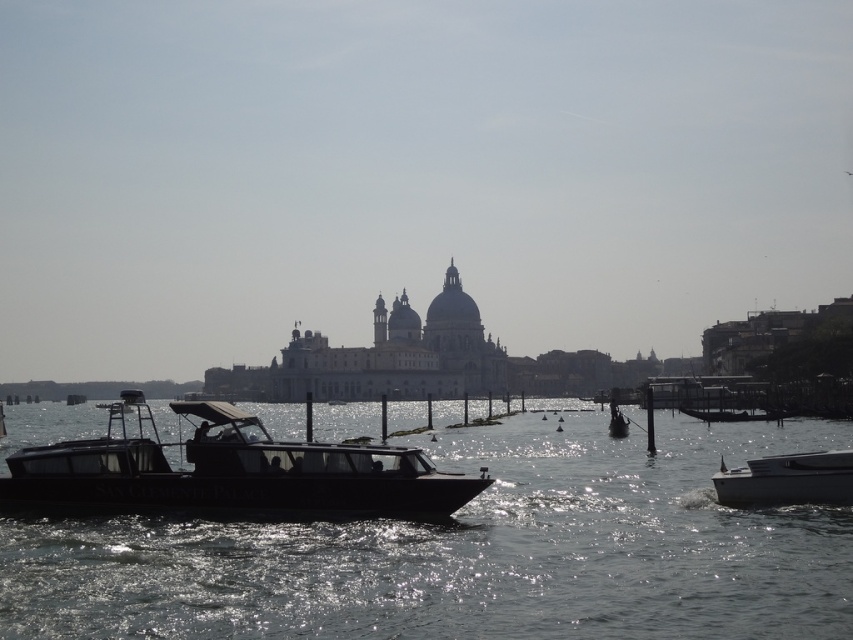
Is transparent water at center bigger than white glossy boat at right?

Correct, transparent water at center is larger in size than white glossy boat at right.

Image resolution: width=853 pixels, height=640 pixels. Describe the element at coordinates (471, 552) in the screenshot. I see `transparent water at center` at that location.

Identify the location of transparent water at center. (471, 552).

Which of these two, transparent water at center or black matte boat at center, stands taller?

black matte boat at center is taller.

Is transparent water at center wider than black matte boat at center?

Correct, the width of transparent water at center exceeds that of black matte boat at center.

The image size is (853, 640). What do you see at coordinates (471, 552) in the screenshot?
I see `transparent water at center` at bounding box center [471, 552].

Locate an element on the screen. This screenshot has width=853, height=640. transparent water at center is located at coordinates (471, 552).

Does black matte boat at center appear on the left side of white glossy boat at right?

Indeed, black matte boat at center is positioned on the left side of white glossy boat at right.

Who is positioned more to the left, black matte boat at center or white glossy boat at right?

black matte boat at center

Where is `black matte boat at center`? black matte boat at center is located at coordinates (229, 472).

Identify the location of black matte boat at center. This screenshot has height=640, width=853. (229, 472).